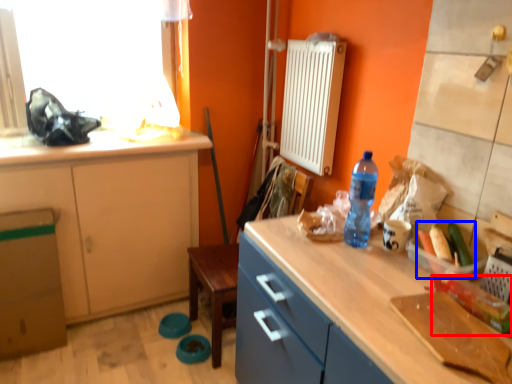
Question: Which object appears closest to the camera in this image, vegetable (highlighted by a red box) or food (highlighted by a blue box)?

Choices:
 (A) vegetable
 (B) food

Answer: (A)